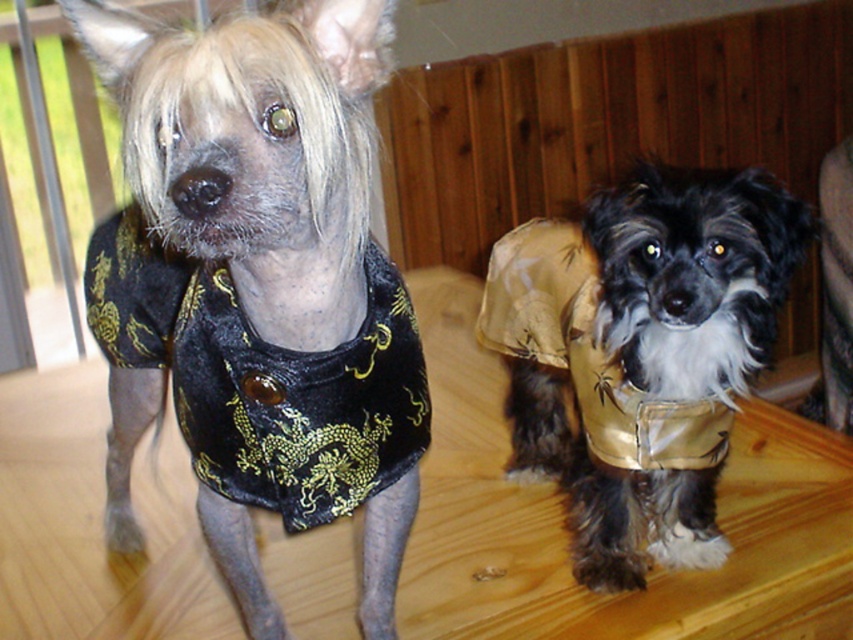
Question: Is velvet black shirt at left further to the viewer compared to gold satin vest at center?

Choices:
 (A) no
 (B) yes

Answer: (A)

Question: Among these points, which one is nearest to the camera?

Choices:
 (A) (366, 266)
 (B) (305, 74)
 (C) (653, 448)

Answer: (B)

Question: Considering the real-world distances, which object is farthest from the velvet black shirt at left?

Choices:
 (A) velvet/black dress at left
 (B) gold satin vest at center

Answer: (B)

Question: Which of the following is the closest to the observer?

Choices:
 (A) (135, 314)
 (B) (614, 545)

Answer: (A)

Question: Does velvet black shirt at left lie in front of gold satin vest at center?

Choices:
 (A) no
 (B) yes

Answer: (B)

Question: Is velvet black shirt at left thinner than velvet/black dress at left?

Choices:
 (A) yes
 (B) no

Answer: (B)